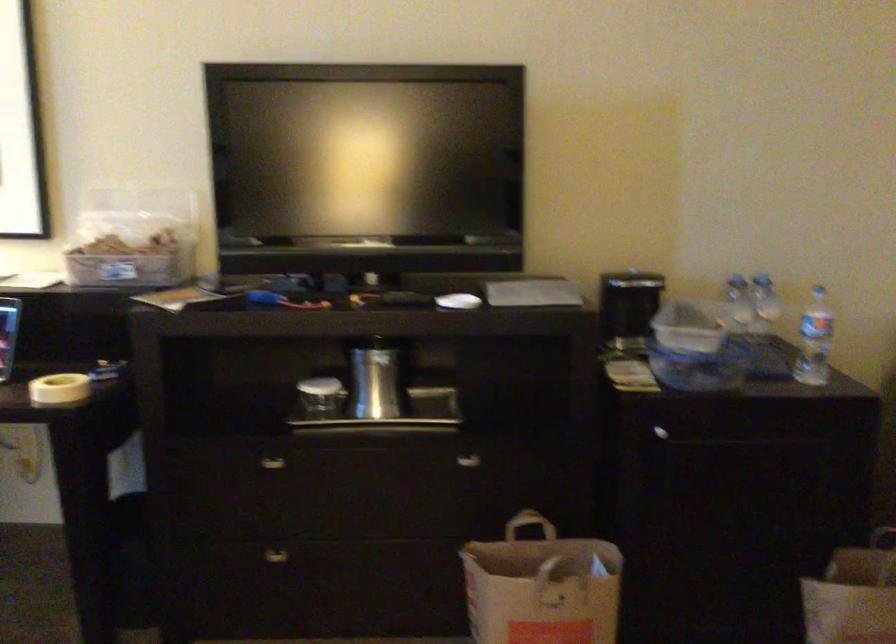
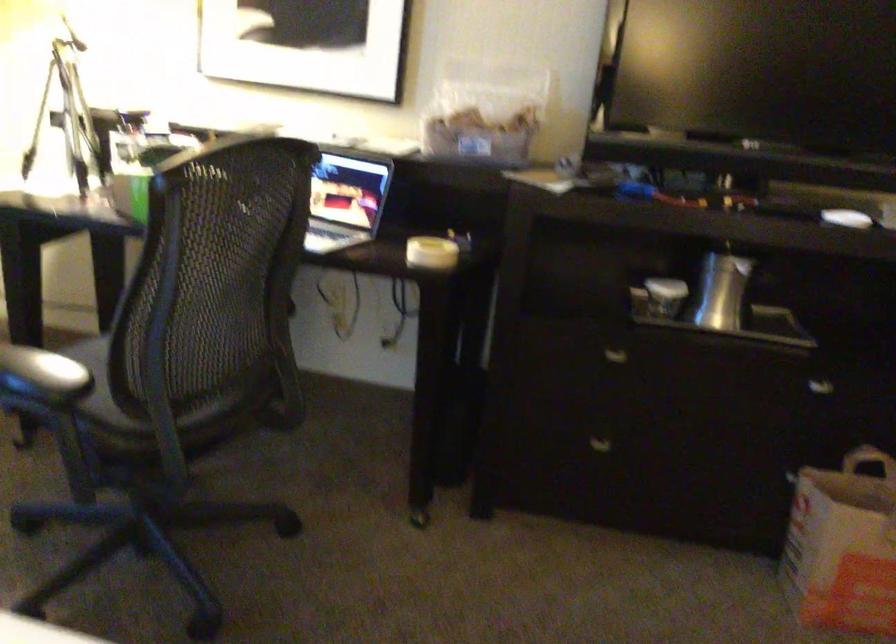
Locate, in the second image, the point that corresponds to point (319, 399) in the first image.

(666, 297)